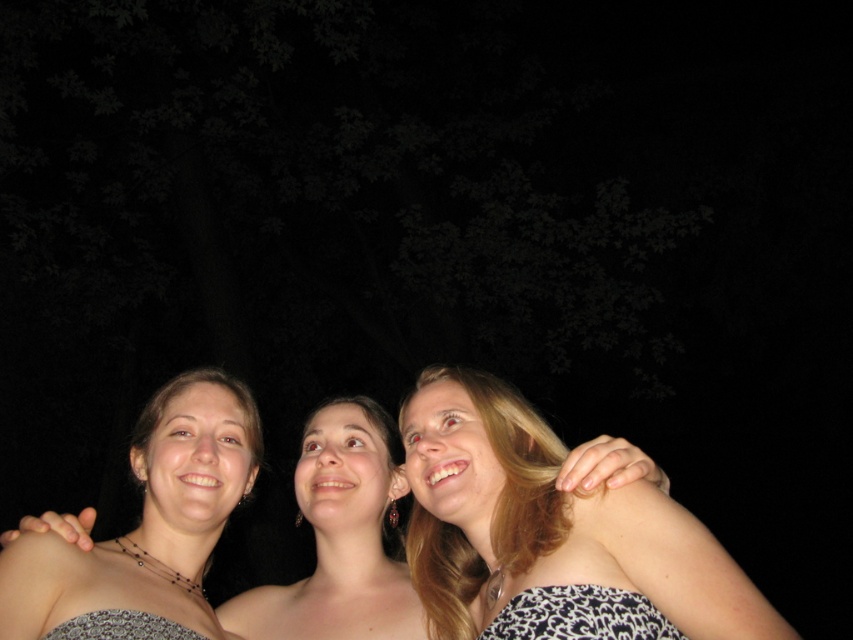
Who is taller, blonde hair at upper right or black printed dress at lower center?

Standing taller between the two is blonde hair at upper right.

Does blonde hair at upper right appear on the left side of black printed dress at lower center?

No, blonde hair at upper right is not to the left of black printed dress at lower center.

Is point (496, 513) closer to viewer compared to point (187, 637)?

Yes, point (496, 513) is in front of point (187, 637).

The image size is (853, 640). Identify the location of blonde hair at upper right. (550, 529).

Between matte black dress at center and black printed dress at lower center, which one appears on the right side from the viewer's perspective?

From the viewer's perspective, black printed dress at lower center appears more on the right side.

In the scene shown: Is matte black dress at center taller than black printed dress at lower center?

Correct, matte black dress at center is much taller as black printed dress at lower center.

You are a GUI agent. You are given a task and a screenshot of the screen. Output one action in this format:
    pyautogui.click(x=<x>, y=<y>)
    Task: Click on the matte black dress at center
    The image size is (853, 640).
    Given the screenshot: What is the action you would take?
    pyautogui.click(x=149, y=516)

Does black printed dress at lower right appear on the right side of black printed dress at lower center?

Indeed, black printed dress at lower right is positioned on the right side of black printed dress at lower center.

Does point (544, 600) lie in front of point (119, 637)?

Yes, it is in front of point (119, 637).

Where is `black printed dress at lower right`? The height and width of the screenshot is (640, 853). black printed dress at lower right is located at coordinates (579, 616).